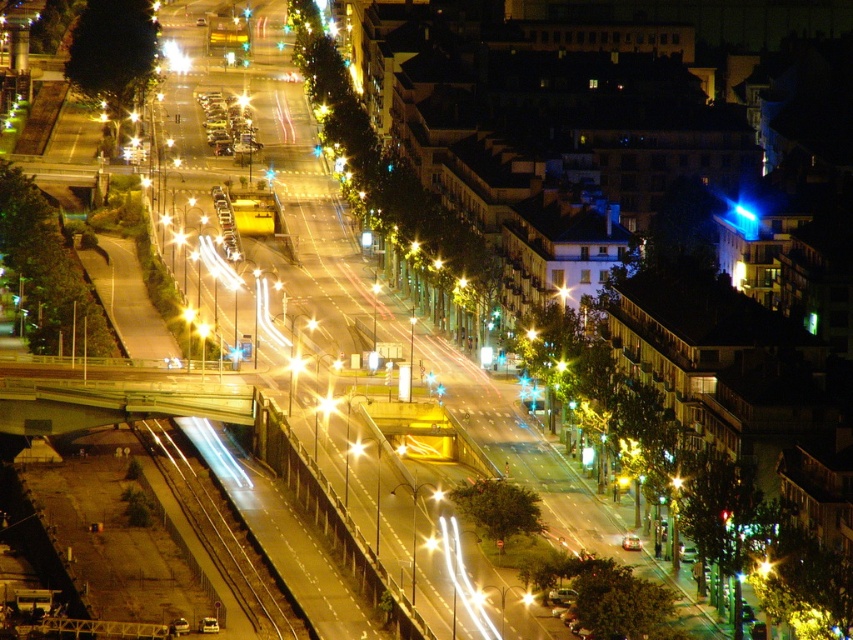
Which is in front, point (131, 392) or point (433, 541)?

Point (433, 541)

Does point (231, 413) lie in front of point (428, 540)?

No.

Locate an element on the screen. Image resolution: width=853 pixels, height=640 pixels. metallic gray bridge at center-left is located at coordinates (112, 396).

Locate an element on the screen. The height and width of the screenshot is (640, 853). brown metallic train track at lower left is located at coordinates click(x=221, y=531).

Does brown metallic train track at lower left appear on the left side of metallic gold streetlight at center?

Yes, brown metallic train track at lower left is to the left of metallic gold streetlight at center.

Where is `brown metallic train track at lower left`? The height and width of the screenshot is (640, 853). brown metallic train track at lower left is located at coordinates (221, 531).

Which is above, metallic gray bridge at center-left or brown metallic train track at lower left?

metallic gray bridge at center-left is above.

Which of these two, metallic gray bridge at center-left or brown metallic train track at lower left, stands shorter?

metallic gray bridge at center-left is shorter.

Locate an element on the screen. This screenshot has height=640, width=853. metallic gray bridge at center-left is located at coordinates (112, 396).